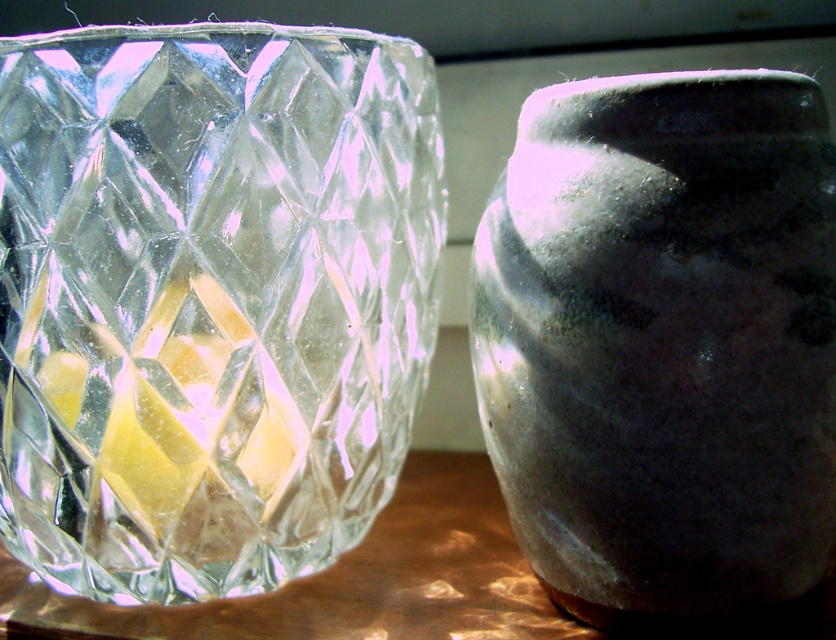
Question: Which point is farther from the camera taking this photo?

Choices:
 (A) [706, 109]
 (B) [366, 481]

Answer: (B)

Question: Among these points, which one is farthest from the camera?

Choices:
 (A) (43, 563)
 (B) (722, 236)

Answer: (A)

Question: Does transparent crystal glass at left have a smaller size compared to matte gray vase at right?

Choices:
 (A) no
 (B) yes

Answer: (A)

Question: Is transparent crystal glass at left above matte gray vase at right?

Choices:
 (A) no
 (B) yes

Answer: (B)

Question: Can you confirm if transparent crystal glass at left is thinner than matte gray vase at right?

Choices:
 (A) yes
 (B) no

Answer: (B)